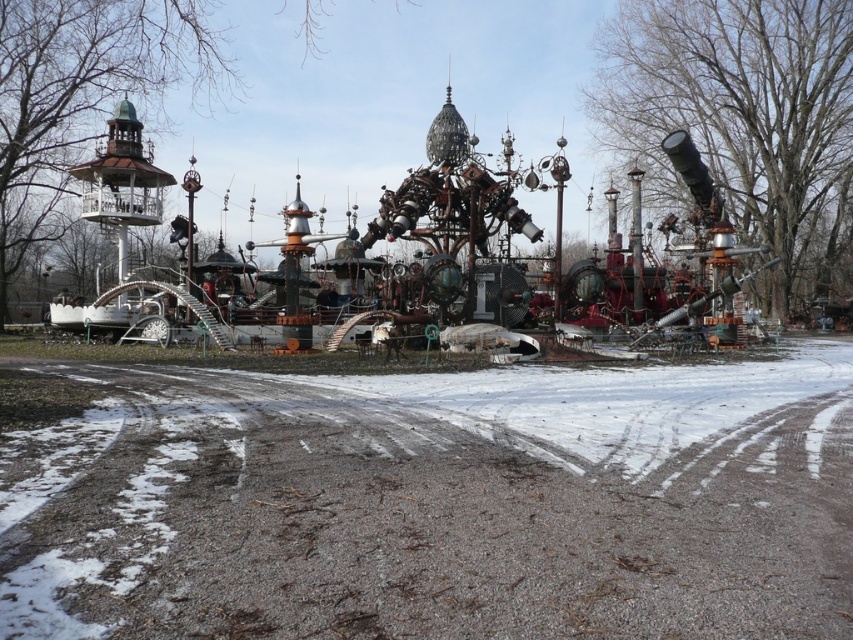
You are a park maintenance worker who needs to clear snow from the area. Based on the image, which object, the white powdery snow at center or the rusty metal amusement park at center, requires more attention for snow removal?

The rusty metal amusement park at center requires more attention for snow removal since the white powdery snow at center has a lesser height compared to it, meaning the amusement park has deeper snow accumulation.

You are a delivery drone with a maximum flight range of 16 meters. You need to deliver a package from the white powdery snow at center to the rusty metal amusement park at center. Can you complete the delivery without needing to recharge?

The white powdery snow at center is 15.93 meters away from the rusty metal amusement park at center. Since the distance is within the drone s 16 meter range, yes, the delivery can be completed without needing to recharge.

You are a park maintenance worker who needs to clear snow from the area. Given that the white powdery snow at center and the rusty metal amusement park at center are both in the central area, which one takes up more space and requires more effort to clear?

The rusty metal amusement park at center occupies more space than the white powdery snow at center, so it requires more effort to clear around it.